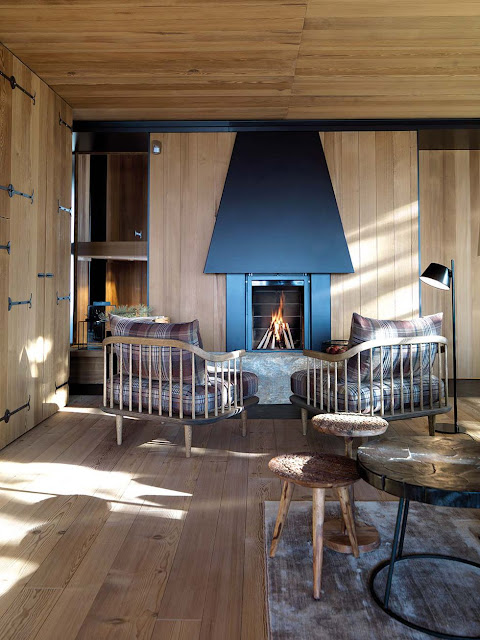
At what (x,y) coordinates should I click in order to perform the action: click on table. Please return your answer as a coordinate pair (x, y). Looking at the image, I should click on (445, 464).